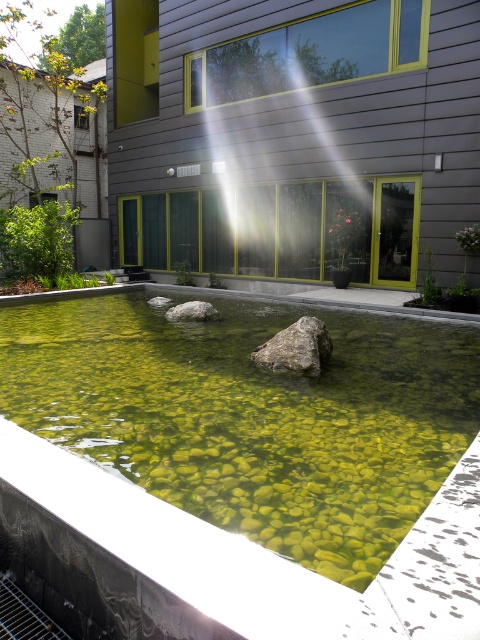
Question: Does green pebbled pool at center have a smaller size compared to gray rough stone at center?

Choices:
 (A) yes
 (B) no

Answer: (A)

Question: Is gray/rough rock at center below gray rough stone at center?

Choices:
 (A) yes
 (B) no

Answer: (A)

Question: Does green pebbled pool at center have a lesser width compared to gray/rough rock at center?

Choices:
 (A) yes
 (B) no

Answer: (A)

Question: Which object is farther from the camera taking this photo?

Choices:
 (A) gray rough stone at center
 (B) green pebbled pool at center

Answer: (A)

Question: Considering the real-world distances, which object is farthest from the gray/rough rock at center?

Choices:
 (A) green pebbled pool at center
 (B) gray rough stone at center

Answer: (B)

Question: Which of the following is the farthest from the observer?

Choices:
 (A) click(177, 308)
 (B) click(298, 337)
 (C) click(147, 384)

Answer: (A)